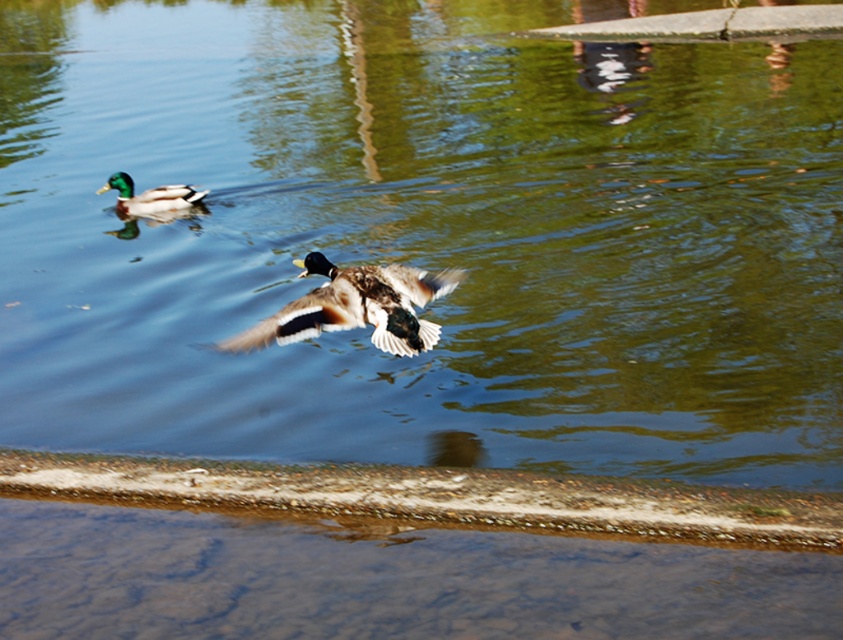
You are a photographer aiming to capture both the brown speckled feathers at center and the green glossy duck at upper left in a single shot. Based on their positions, which object should you focus on first to ensure both are in frame?

The brown speckled feathers at center is located below the green glossy duck at upper left, so you should focus on the green glossy duck at upper left first to ensure both are in frame.

You are a photographer trying to capture the brown speckled feathers at center and the green glossy duck at upper left in the same frame. Which object should you focus on first if you want to ensure both are in focus without adjusting the camera settings?

The brown speckled feathers at center is larger in size than the green glossy duck at upper left, so focusing on the larger object first will help ensure both are in focus.